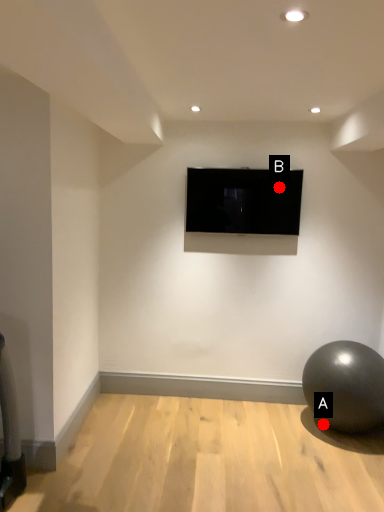
Question: Two points are circled on the image, labeled by A and B beside each circle. Which point is closer to the camera?

Choices:
 (A) A is closer
 (B) B is closer

Answer: (A)